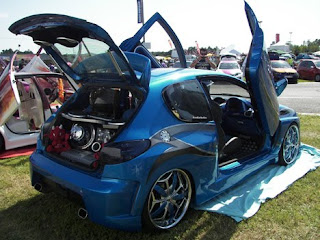
Where is `window`? The height and width of the screenshot is (240, 320). window is located at coordinates (192, 100).